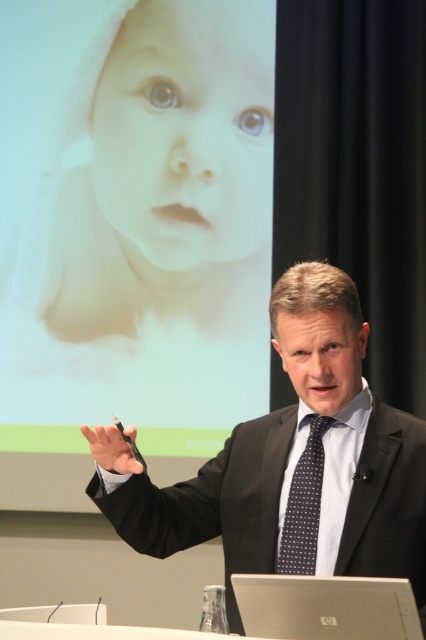
Question: Which point is farther to the camera?

Choices:
 (A) smooth white baby at upper left
 (B) dark blue dotted tie at center

Answer: (A)

Question: Does smooth white baby at upper left come behind dark blue dotted tie at center?

Choices:
 (A) no
 (B) yes

Answer: (B)

Question: Based on their relative distances, which object is nearer to the silver metallic laptop at lower center?

Choices:
 (A) smooth white baby at upper left
 (B) dark blue dotted tie at center

Answer: (B)

Question: Based on their relative distances, which object is nearer to the smooth white baby at upper left?

Choices:
 (A) black suit at center
 (B) dark blue dotted tie at center

Answer: (A)

Question: Is silver metallic laptop at lower center below dark blue dotted tie at center?

Choices:
 (A) yes
 (B) no

Answer: (A)

Question: Considering the relative positions of smooth white baby at upper left and black suit at center in the image provided, where is smooth white baby at upper left located with respect to black suit at center?

Choices:
 (A) above
 (B) below

Answer: (A)